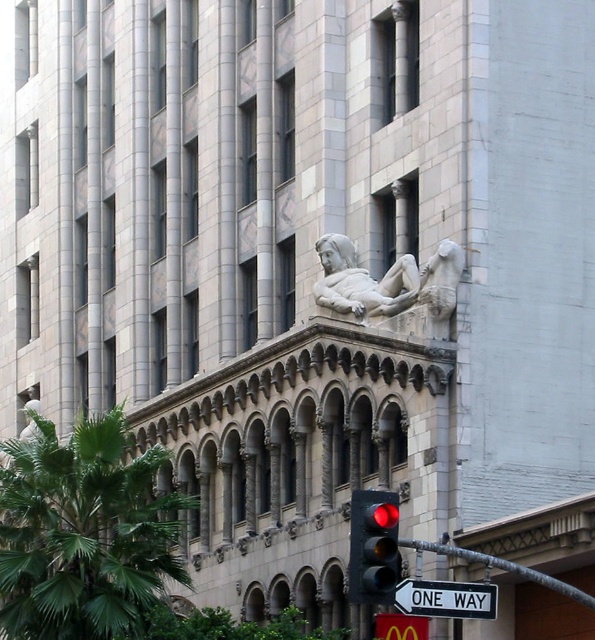
Question: Which of the following is the farthest from the observer?

Choices:
 (A) white plastic sign at lower right
 (B) green leafy palm tree at center
 (C) white marble reclining figure at upper center
 (D) red glass traffic light at center

Answer: (C)

Question: Among these points, which one is nearest to the camera?

Choices:
 (A) (439, 257)
 (B) (111, 504)

Answer: (B)

Question: In this image, where is green leafy palm tree at center located relative to red glass traffic light at center?

Choices:
 (A) below
 (B) above

Answer: (A)

Question: Estimate the real-world distances between objects in this image. Which object is farther from the green leafy palm tree at center?

Choices:
 (A) stone statue at center
 (B) white plastic sign at lower right

Answer: (B)

Question: Observing the image, what is the correct spatial positioning of green leafy palm tree at center in reference to white marble reclining figure at upper center?

Choices:
 (A) right
 (B) left

Answer: (B)

Question: Can you confirm if stone statue at center is wider than white marble reclining figure at upper center?

Choices:
 (A) yes
 (B) no

Answer: (B)